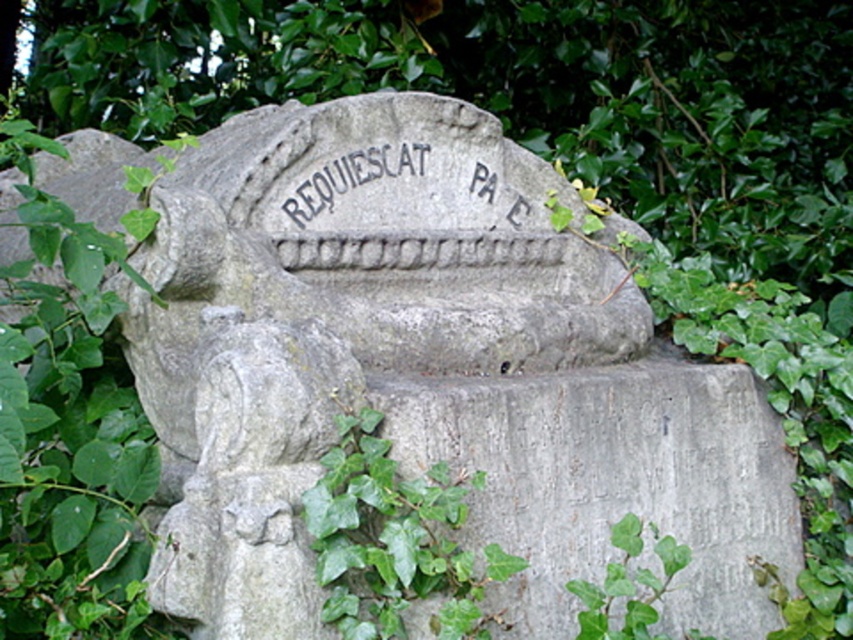
Question: Does green leafy ivy at lower center appear on the left side of black stone inscription at center?

Choices:
 (A) yes
 (B) no

Answer: (B)

Question: Does green leafy ivy at lower center come in front of green leafy ivy at lower right?

Choices:
 (A) no
 (B) yes

Answer: (B)

Question: Which point is closer to the camera?

Choices:
 (A) (384, 147)
 (B) (585, 602)
 (C) (473, 477)

Answer: (B)

Question: Estimate the real-world distances between objects in this image. Which object is farther from the black stone inscription at center?

Choices:
 (A) green leafy ivy at lower center
 (B) green leafy ivy at lower right

Answer: (B)

Question: Does green leafy ivy at lower right have a larger size compared to black stone inscription at center?

Choices:
 (A) no
 (B) yes

Answer: (B)

Question: Which point appears closest to the camera in this image?

Choices:
 (A) (306, 189)
 (B) (465, 573)
 (C) (640, 586)

Answer: (B)